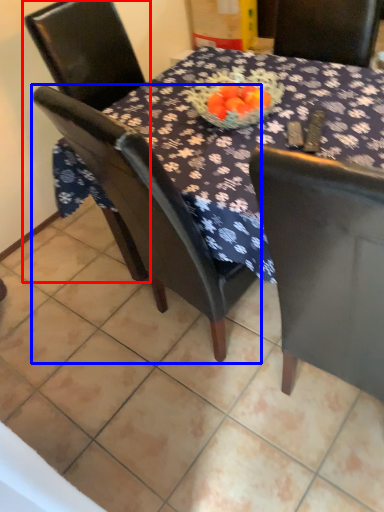
Question: Which object appears farthest to the camera in this image, chair (highlighted by a red box) or chair (highlighted by a blue box)?

Choices:
 (A) chair
 (B) chair

Answer: (A)